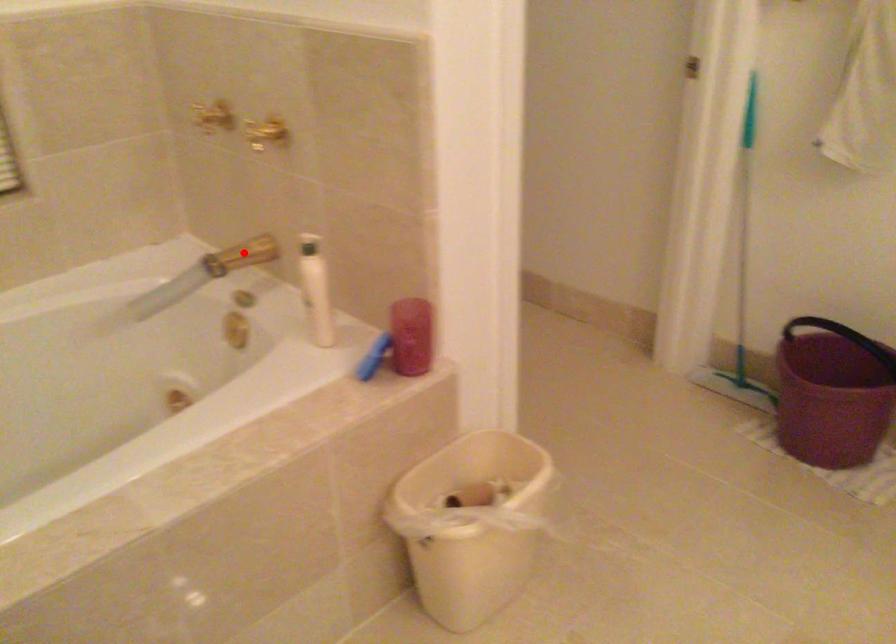
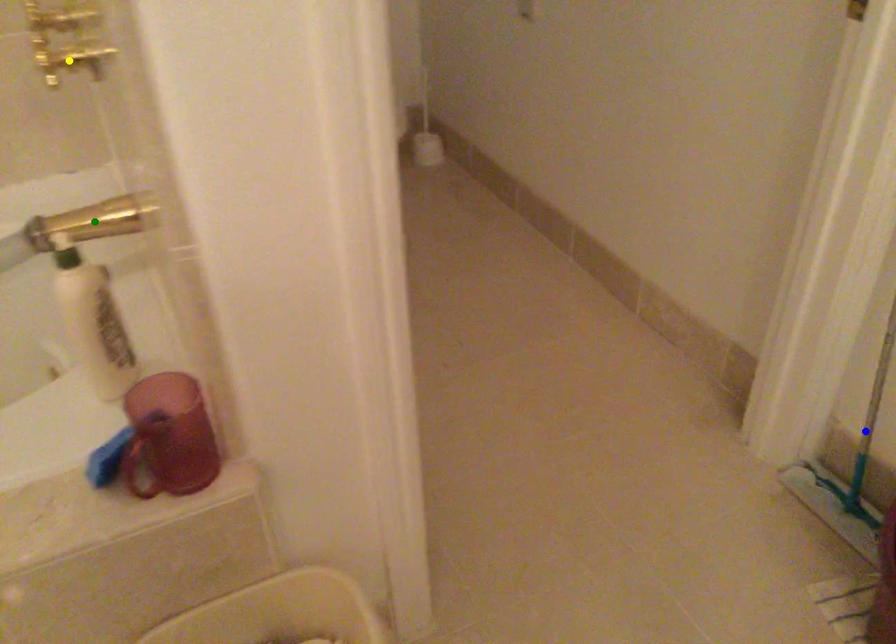
Question: I am providing you with two images of the same scene from different viewpoints. A red point is marked on the first image. You are given multiple points on the second image. Which mark in image 2 goes with the point in image 1?

Choices:
 (A) yellow point
 (B) blue point
 (C) green point

Answer: (C)